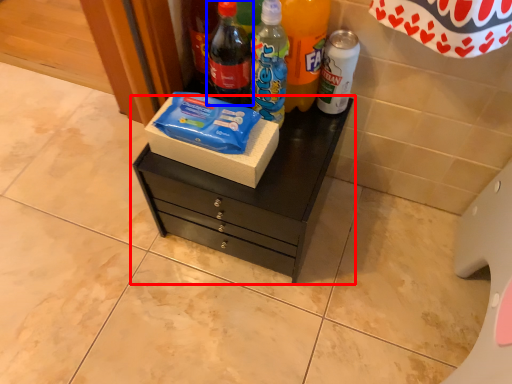
Question: Which of the following is the farthest to the observer, chest of drawers (highlighted by a red box) or bottle (highlighted by a blue box)?

Choices:
 (A) chest of drawers
 (B) bottle

Answer: (A)